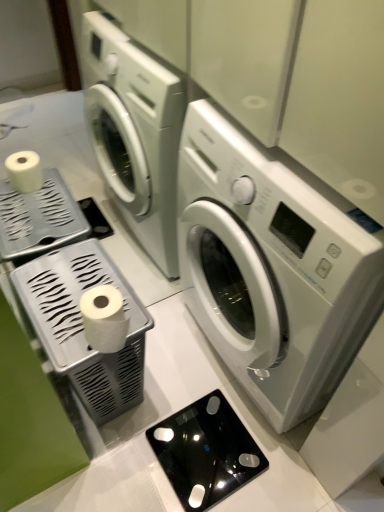
Question: Is white plastic tissue holder at left, arranged as the 1th appliance when viewed from the left, wider than black glass scale at lower center, the 1th appliance in the right-to-left sequence?

Choices:
 (A) yes
 (B) no

Answer: (B)

Question: Is white plastic tissue holder at left, arranged as the 1th appliance when viewed from the left, to the left of black glass scale at lower center, the 1th appliance in the right-to-left sequence, from the viewer's perspective?

Choices:
 (A) yes
 (B) no

Answer: (A)

Question: Is white plastic tissue holder at left, arranged as the 1th appliance when viewed from the left, oriented away from black glass scale at lower center, placed as the 2th appliance when sorted from left to right?

Choices:
 (A) no
 (B) yes

Answer: (A)

Question: Can you confirm if white plastic tissue holder at left, which is the 2th appliance from right to left, is bigger than black glass scale at lower center, the 1th appliance in the right-to-left sequence?

Choices:
 (A) yes
 (B) no

Answer: (A)

Question: From a real-world perspective, does white plastic tissue holder at left, arranged as the 1th appliance when viewed from the left, sit lower than black glass scale at lower center, placed as the 2th appliance when sorted from left to right?

Choices:
 (A) no
 (B) yes

Answer: (A)

Question: From the image's perspective, is white plastic tissue holder at left, arranged as the 1th appliance when viewed from the left, positioned above or below white glossy washing machine at center?

Choices:
 (A) above
 (B) below

Answer: (B)

Question: Does point (69, 337) appear closer or farther from the camera than point (201, 320)?

Choices:
 (A) closer
 (B) farther

Answer: (A)

Question: Is white plastic tissue holder at left, arranged as the 1th appliance when viewed from the left, in front of or behind white glossy washing machine at center in the image?

Choices:
 (A) front
 (B) behind

Answer: (B)

Question: In terms of width, does white plastic tissue holder at left, which is the 2th appliance from right to left, look wider or thinner when compared to white glossy washing machine at center?

Choices:
 (A) thin
 (B) wide

Answer: (A)

Question: Considering the positions of black glass scale at lower center, the 1th appliance in the right-to-left sequence, and white plastic tissue holder at left, arranged as the 1th appliance when viewed from the left, in the image, is black glass scale at lower center, the 1th appliance in the right-to-left sequence, taller or shorter than white plastic tissue holder at left, arranged as the 1th appliance when viewed from the left,?

Choices:
 (A) short
 (B) tall

Answer: (A)

Question: Is black glass scale at lower center, placed as the 2th appliance when sorted from left to right, bigger or smaller than white plastic tissue holder at left, arranged as the 1th appliance when viewed from the left?

Choices:
 (A) big
 (B) small

Answer: (B)

Question: From a real-world perspective, is black glass scale at lower center, the 1th appliance in the right-to-left sequence, above or below white plastic tissue holder at left, arranged as the 1th appliance when viewed from the left?

Choices:
 (A) above
 (B) below

Answer: (B)

Question: From the image's perspective, relative to white plastic tissue holder at left, which is the 2th appliance from right to left, is black glass scale at lower center, placed as the 2th appliance when sorted from left to right, above or below?

Choices:
 (A) above
 (B) below

Answer: (B)

Question: Is point (281, 236) positioned closer to the camera than point (77, 261)?

Choices:
 (A) farther
 (B) closer

Answer: (B)

Question: In terms of height, does white glossy washing machine at center look taller or shorter compared to white plastic tissue holder at left, arranged as the 1th appliance when viewed from the left?

Choices:
 (A) tall
 (B) short

Answer: (A)